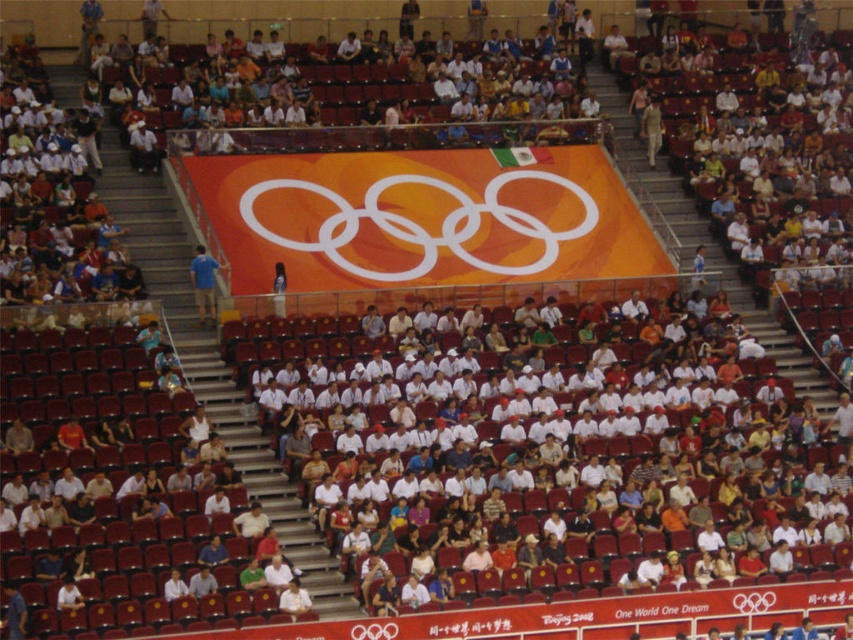
Who is more distant from viewer, (206, 284) or (656, 124)?

Positioned behind is point (656, 124).

From the picture: Is blue fabric shirt at center shorter than light brown leather jacket at upper right?

Incorrect, blue fabric shirt at center's height does not fall short of light brown leather jacket at upper right's.

Who is more distant from viewer, (202, 266) or (653, 131)?

The point (653, 131) is more distant.

Where is `blue fabric shirt at center`? The image size is (853, 640). blue fabric shirt at center is located at coordinates (204, 284).